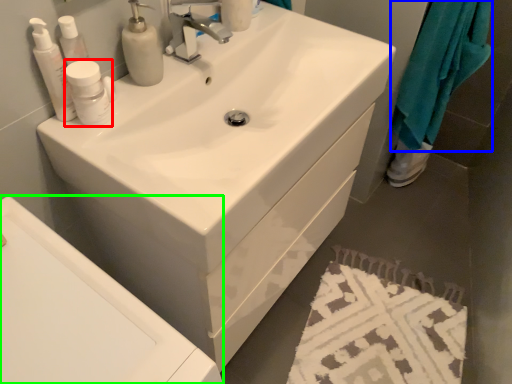
Question: Considering the real-world distances, which object is farthest from mouthwash (highlighted by a red box)? cloth (highlighted by a blue box) or bath (highlighted by a green box)?

Choices:
 (A) cloth
 (B) bath

Answer: (A)